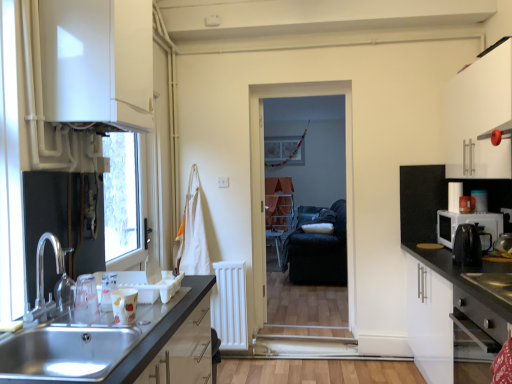
Question: Is the depth of silver metallic faucet at sink left greater than that of black fabric screen door at center?

Choices:
 (A) yes
 (B) no

Answer: (B)

Question: Are silver metallic faucet at sink left and black fabric screen door at center located far from each other?

Choices:
 (A) no
 (B) yes

Answer: (B)

Question: From a real-world perspective, is silver metallic faucet at sink left below black fabric screen door at center?

Choices:
 (A) yes
 (B) no

Answer: (A)

Question: Can you confirm if silver metallic faucet at sink left is smaller than black fabric screen door at center?

Choices:
 (A) no
 (B) yes

Answer: (B)

Question: Does silver metallic faucet at sink left have a lesser height compared to black fabric screen door at center?

Choices:
 (A) no
 (B) yes

Answer: (B)

Question: Considering the relative sizes of silver metallic faucet at sink left and black fabric screen door at center in the image provided, is silver metallic faucet at sink left thinner than black fabric screen door at center?

Choices:
 (A) yes
 (B) no

Answer: (B)

Question: Considering the relative sizes of white fabric laundry at center and black plastic kettle at right, the second appliance from the back, in the image provided, is white fabric laundry at center taller than black plastic kettle at right, the second appliance from the back,?

Choices:
 (A) no
 (B) yes

Answer: (B)

Question: From the image's perspective, is white fabric laundry at center beneath black plastic kettle at right, placed as the 1th appliance when sorted from front to back?

Choices:
 (A) yes
 (B) no

Answer: (B)

Question: Is white fabric laundry at center thinner than black plastic kettle at right, the second appliance from the back?

Choices:
 (A) no
 (B) yes

Answer: (A)

Question: From a real-world perspective, is white fabric laundry at center positioned under black plastic kettle at right, placed as the 1th appliance when sorted from front to back, based on gravity?

Choices:
 (A) no
 (B) yes

Answer: (A)

Question: Would you say white fabric laundry at center is a long distance from black plastic kettle at right, the second appliance from the back?

Choices:
 (A) no
 (B) yes

Answer: (B)

Question: Considering the relative sizes of white fabric laundry at center and black plastic kettle at right, placed as the 1th appliance when sorted from front to back, in the image provided, is white fabric laundry at center shorter than black plastic kettle at right, placed as the 1th appliance when sorted from front to back,?

Choices:
 (A) yes
 (B) no

Answer: (B)

Question: Could you tell me if black plastic coffee machine at right is turned towards stainless steel oven at lower right?

Choices:
 (A) yes
 (B) no

Answer: (B)